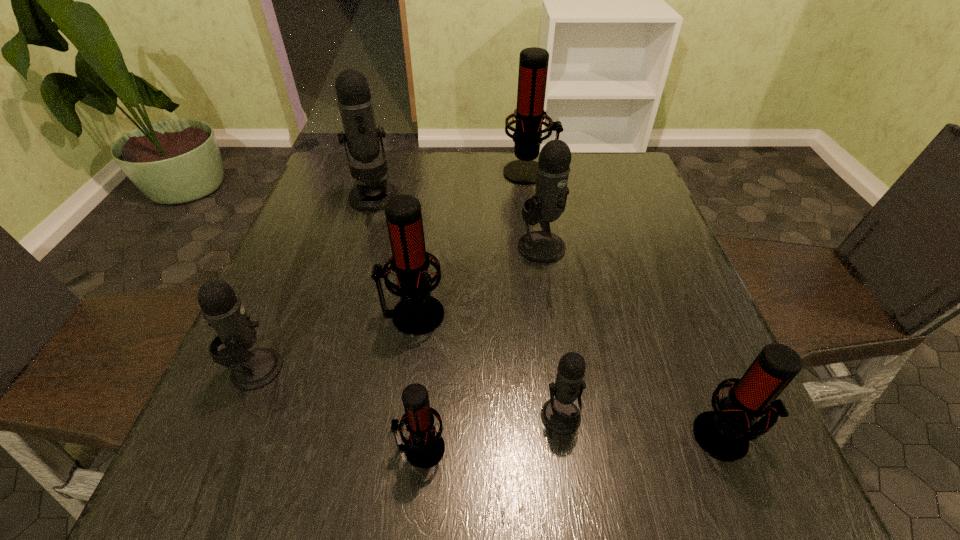
Locate an element on the screen. the leftmost microphone is located at coordinates (251, 370).

Where is `the fifth farthest microphone`? The image size is (960, 540). the fifth farthest microphone is located at coordinates (251, 370).

Find the location of a particular element. the smallest black microphone is located at coordinates (560, 415).

Identify the location of the smallest red microphone. pos(425,447).

Locate an element on the screen. free space located 0.120m on the left of the second red microphone from right to left is located at coordinates (461, 172).

Where is `free region located 0.380m on the front of the seventh object from right to left`? free region located 0.380m on the front of the seventh object from right to left is located at coordinates (334, 333).

Locate an element on the screen. The width and height of the screenshot is (960, 540). vacant area located 0.290m on the front of the second biggest black microphone is located at coordinates (561, 376).

This screenshot has height=540, width=960. In order to click on vacant area situated on the back of the fourth farthest microphone in this screenshot , I will do `click(428, 205)`.

Locate an element on the screen. The image size is (960, 540). vacant space located 0.210m on the left of the rightmost object is located at coordinates (562, 436).

You are a GUI agent. You are given a task and a screenshot of the screen. Output one action in this format:
    pyautogui.click(x=<x>, y=<y>)
    Task: Click on the free space located 0.220m on the back of the leftmost black microphone
    The width and height of the screenshot is (960, 540).
    Given the screenshot: What is the action you would take?
    pyautogui.click(x=299, y=267)